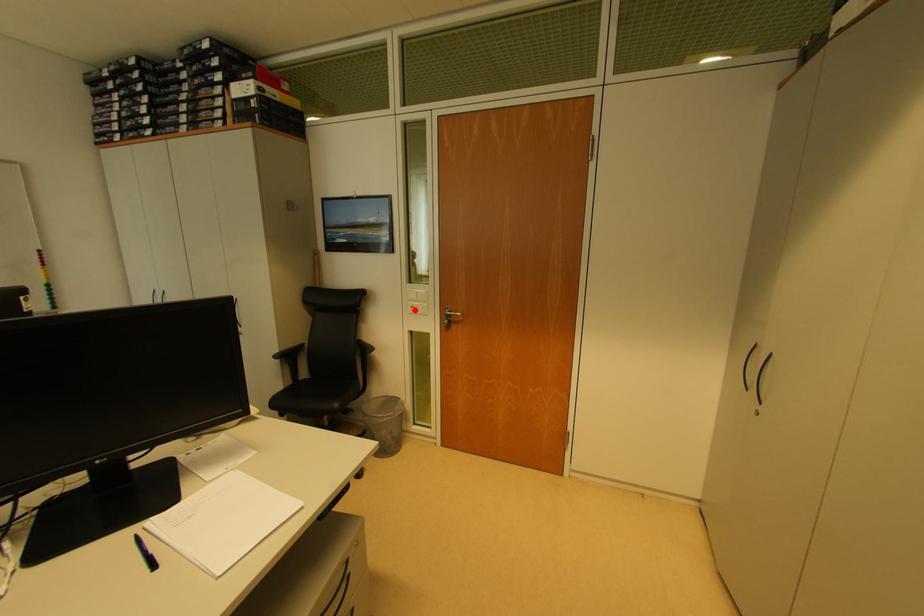
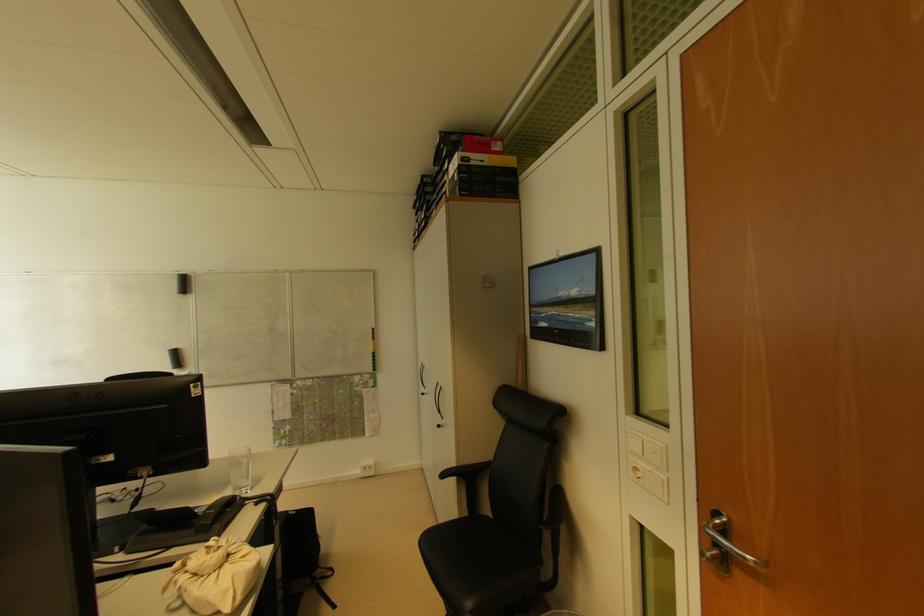
Where in the second image is the point corresponding to the highlighted location from the first image?

(638, 471)